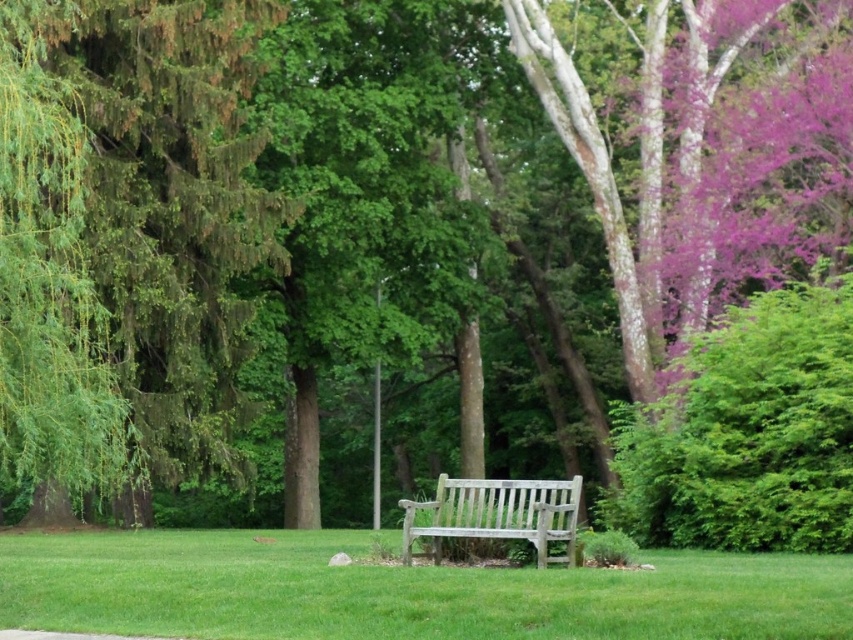
You are sitting on the wooden bench at center and want to look at the green leafy tree at left. In which direction should you turn your head?

You should turn your head to the left to look at the green leafy tree at left since it is positioned on the left side of the wooden bench at center.

You are sitting on the wooden bench at center and looking towards the green leafy tree at left. Which object is taller when you look up from the bench?

The green leafy tree at left is taller than the wooden bench at center, so when looking up from the bench, the green leafy tree at left will appear taller.